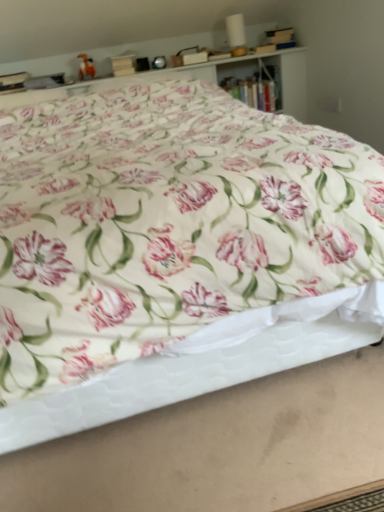
Question: From the image's perspective, relative to white quilted mattress at lower center, is floral fabric bed at center above or below?

Choices:
 (A) above
 (B) below

Answer: (A)

Question: Considering the positions of floral fabric bed at center and white quilted mattress at lower center in the image, is floral fabric bed at center bigger or smaller than white quilted mattress at lower center?

Choices:
 (A) small
 (B) big

Answer: (B)

Question: Which is farther from the floral fabric bed at center?

Choices:
 (A) white quilted mattress at lower center
 (B) wooden bookshelf at upper center

Answer: (B)

Question: Which is nearer to the floral fabric bed at center?

Choices:
 (A) wooden bookshelf at upper center
 (B) white quilted mattress at lower center

Answer: (B)